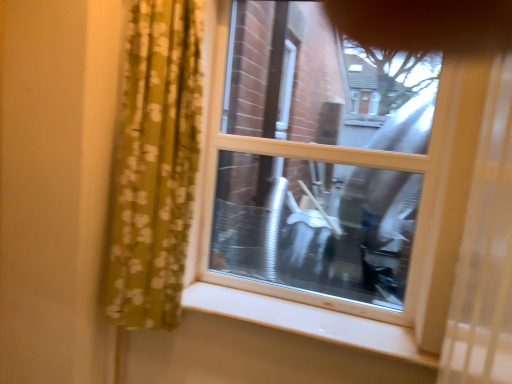
What do you see at coordinates (307, 321) in the screenshot?
I see `white smooth window sill at lower center` at bounding box center [307, 321].

Image resolution: width=512 pixels, height=384 pixels. I want to click on white smooth window sill at lower center, so (307, 321).

Where is `transparent glass window at center`? transparent glass window at center is located at coordinates (395, 150).

This screenshot has width=512, height=384. What do you see at coordinates (395, 150) in the screenshot?
I see `transparent glass window at center` at bounding box center [395, 150].

Image resolution: width=512 pixels, height=384 pixels. I want to click on white smooth window sill at lower center, so click(307, 321).

Which object is positioned more to the right, white smooth window sill at lower center or transparent glass window at center?

transparent glass window at center is more to the right.

In the scene shown: Which object is closer to the camera, white smooth window sill at lower center or transparent glass window at center?

Positioned in front is white smooth window sill at lower center.

Is point (373, 326) positioned before point (481, 72)?

No, it is not.

From the image's perspective, between white smooth window sill at lower center and transparent glass window at center, who is located below?

From the image's view, white smooth window sill at lower center is below.

From a real-world perspective, which object rests below the other?

white smooth window sill at lower center is physically lower.

In terms of width, does white smooth window sill at lower center look wider or thinner when compared to transparent glass window at center?

Clearly, white smooth window sill at lower center has more width compared to transparent glass window at center.

Which of these two, white smooth window sill at lower center or transparent glass window at center, stands taller?

transparent glass window at center is taller.

Based on the photo, who is smaller, white smooth window sill at lower center or transparent glass window at center?

white smooth window sill at lower center is smaller.

Is white smooth window sill at lower center located outside transparent glass window at center?

white smooth window sill at lower center lies outside transparent glass window at center's area.

Is white smooth window sill at lower center far away from transparent glass window at center?

No, white smooth window sill at lower center is not far away from transparent glass window at center.

Is white smooth window sill at lower center oriented towards transparent glass window at center?

No, white smooth window sill at lower center is not aimed at transparent glass window at center.

From the picture: What's the angular difference between white smooth window sill at lower center and transparent glass window at center's facing directions?

The angular difference between white smooth window sill at lower center and transparent glass window at center is 0.424 degrees.

Consider the image. How far apart are white smooth window sill at lower center and transparent glass window at center?

The distance of white smooth window sill at lower center from transparent glass window at center is 14.12 inches.

I want to click on window sill lying in front of the transparent glass window at center, so click(x=307, y=321).

Which object is positioned more to the right, transparent glass window at center or white smooth window sill at lower center?

From the viewer's perspective, transparent glass window at center appears more on the right side.

Which is in front, transparent glass window at center or white smooth window sill at lower center?

white smooth window sill at lower center is closer to the camera.

Which is in front, point (432, 158) or point (368, 326)?

Point (432, 158)

From the image's perspective, would you say transparent glass window at center is shown under white smooth window sill at lower center?

Actually, transparent glass window at center appears above white smooth window sill at lower center in the image.

From a real-world perspective, who is located lower, transparent glass window at center or white smooth window sill at lower center?

In real-world perspective, white smooth window sill at lower center is lower.

Considering the sizes of transparent glass window at center and white smooth window sill at lower center in the image, is transparent glass window at center wider or thinner than white smooth window sill at lower center?

In the image, transparent glass window at center appears to be more narrow than white smooth window sill at lower center.

In the scene shown: Does transparent glass window at center have a lesser height compared to white smooth window sill at lower center?

No.

Between transparent glass window at center and white smooth window sill at lower center, which one has smaller size?

white smooth window sill at lower center is smaller.

Is transparent glass window at center surrounding white smooth window sill at lower center?

That's incorrect, white smooth window sill at lower center is not inside transparent glass window at center.

Is transparent glass window at center next to white smooth window sill at lower center?

No.

Is transparent glass window at center positioned with its back to white smooth window sill at lower center?

That's not correct — transparent glass window at center is not looking away from white smooth window sill at lower center.

How different are the orientations of transparent glass window at center and white smooth window sill at lower center in degrees?

The angle between the facing direction of transparent glass window at center and the facing direction of white smooth window sill at lower center is 0.424 degrees.

Looking at this image, measure the distance between transparent glass window at center and white smooth window sill at lower center.

transparent glass window at center and white smooth window sill at lower center are 14.12 inches apart.

Locate an element on the screen. window sill in front of the transparent glass window at center is located at coordinates (307, 321).

There is a white smooth window sill at lower center. Where is `window above it (from a real-world perspective)`? The height and width of the screenshot is (384, 512). window above it (from a real-world perspective) is located at coordinates (395, 150).

Image resolution: width=512 pixels, height=384 pixels. Find the location of `window above the white smooth window sill at lower center (from the image's perspective)`. window above the white smooth window sill at lower center (from the image's perspective) is located at coordinates (395, 150).